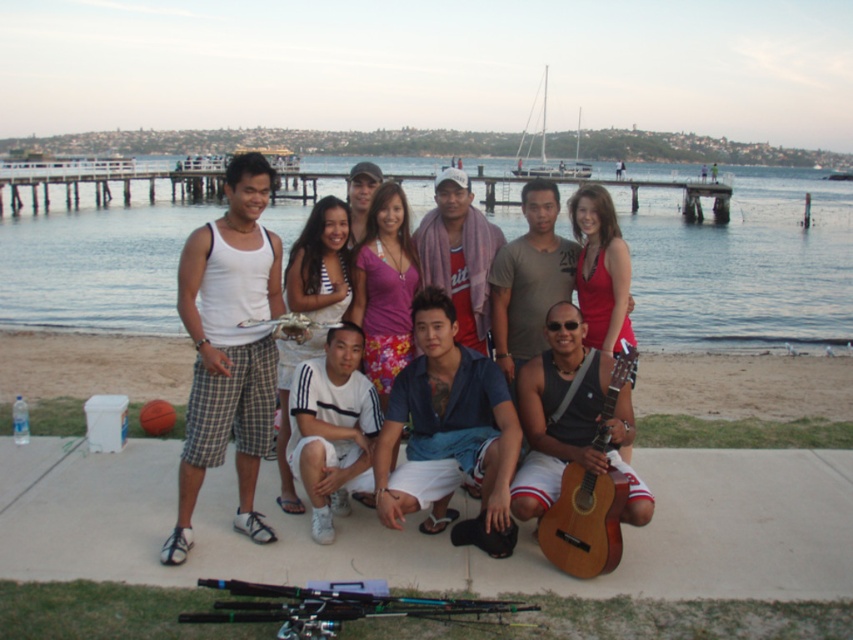
Question: Among these points, which one is farthest from the camera?

Choices:
 (A) (366, 406)
 (B) (328, 253)
 (C) (614, 401)

Answer: (B)

Question: Is blue cotton shirt at center closer to camera compared to wooden acoustic guitar at lower center?

Choices:
 (A) yes
 (B) no

Answer: (B)

Question: Among these objects, which one is farthest from the camera?

Choices:
 (A) white cotton tank top at left
 (B) clear blue water at upper center
 (C) wooden acoustic guitar at lower center
 (D) white cotton shorts at center

Answer: (B)

Question: Is clear blue water at upper center to the right of white tank top at center from the viewer's perspective?

Choices:
 (A) yes
 (B) no

Answer: (A)

Question: Does white cotton tank top at left have a smaller size compared to wooden acoustic guitar at lower center?

Choices:
 (A) yes
 (B) no

Answer: (B)

Question: Which of these objects is positioned farthest from the wooden acoustic guitar at lower center?

Choices:
 (A) white cotton tank top at left
 (B) clear blue water at upper center
 (C) white cotton shorts at center

Answer: (B)